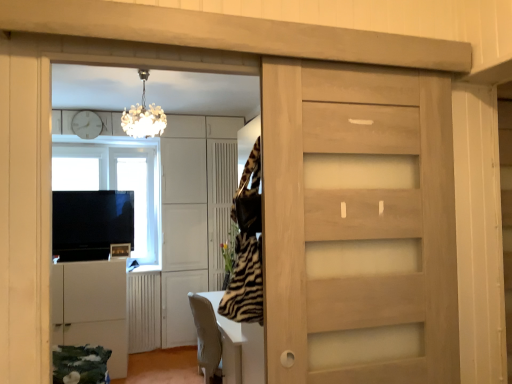
Question: Is matte white cabinet at left further to camera compared to transparent glass window at upper left?

Choices:
 (A) no
 (B) yes

Answer: (A)

Question: Is matte white cabinet at left oriented away from transparent glass window at upper left?

Choices:
 (A) yes
 (B) no

Answer: (B)

Question: Can you confirm if matte white cabinet at left is shorter than transparent glass window at upper left?

Choices:
 (A) yes
 (B) no

Answer: (A)

Question: Is matte white cabinet at left bigger than transparent glass window at upper left?

Choices:
 (A) yes
 (B) no

Answer: (B)

Question: Is matte white cabinet at left to the right of transparent glass window at upper left from the viewer's perspective?

Choices:
 (A) no
 (B) yes

Answer: (B)

Question: Is transparent glass window at upper left in front of or behind metallic silver toaster at lower left, marked as the first appliance in a bottom-to-top arrangement, in the image?

Choices:
 (A) behind
 (B) front

Answer: (A)

Question: Is transparent glass window at upper left bigger or smaller than metallic silver toaster at lower left, marked as the 2th appliance in a top-to-bottom arrangement?

Choices:
 (A) big
 (B) small

Answer: (A)

Question: From their relative heights in the image, would you say transparent glass window at upper left is taller or shorter than metallic silver toaster at lower left, marked as the 2th appliance in a top-to-bottom arrangement?

Choices:
 (A) tall
 (B) short

Answer: (A)

Question: Is point (152, 150) closer or farther from the camera than point (112, 254)?

Choices:
 (A) closer
 (B) farther

Answer: (B)

Question: Is white wooden clock at upper center to the left or to the right of metallic silver toaster at lower left, marked as the 2th appliance in a top-to-bottom arrangement, in the image?

Choices:
 (A) right
 (B) left

Answer: (B)

Question: In terms of width, does white wooden clock at upper center look wider or thinner when compared to metallic silver toaster at lower left, marked as the 2th appliance in a top-to-bottom arrangement?

Choices:
 (A) thin
 (B) wide

Answer: (B)

Question: From the image's perspective, relative to metallic silver toaster at lower left, marked as the 2th appliance in a top-to-bottom arrangement, is white wooden clock at upper center above or below?

Choices:
 (A) below
 (B) above

Answer: (B)

Question: Considering the positions of white wooden clock at upper center and metallic silver toaster at lower left, marked as the 2th appliance in a top-to-bottom arrangement, in the image, is white wooden clock at upper center taller or shorter than metallic silver toaster at lower left, marked as the 2th appliance in a top-to-bottom arrangement,?

Choices:
 (A) short
 (B) tall

Answer: (B)

Question: Visually, is matte white cabinet at left positioned to the left or to the right of white glossy table at center?

Choices:
 (A) right
 (B) left

Answer: (B)

Question: Does point (66, 306) appear closer or farther from the camera than point (242, 364)?

Choices:
 (A) closer
 (B) farther

Answer: (B)